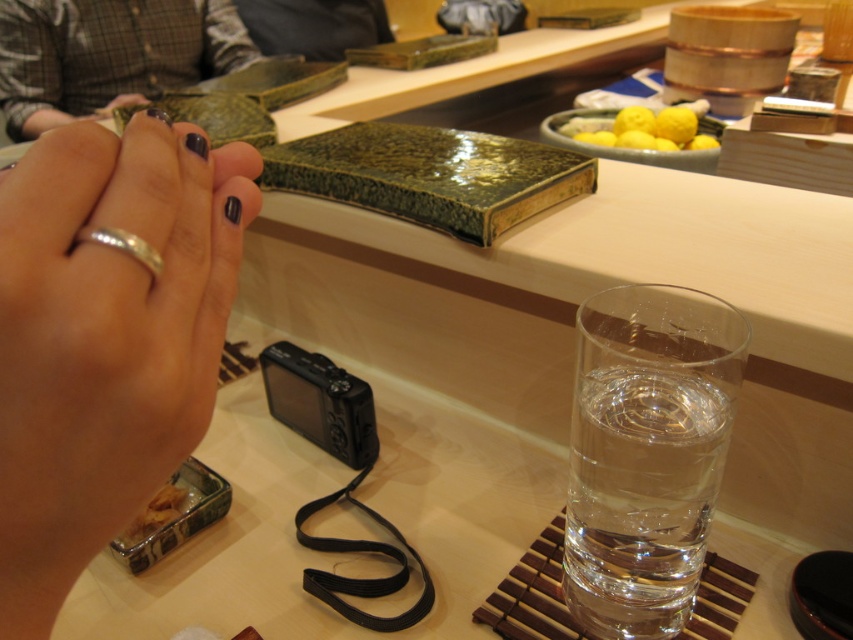
You are a photographer setting up a shoot at this table. You need to place a new prop between the matte plaid shirt at upper left and the nail polish at center. Where should you position it to ensure it is centered between them?

The matte plaid shirt at upper left is to the left of the nail polish at center, so placing the prop exactly halfway between them would center it between the two objects.

You are a photographer trying to place a small decorative item between the matte plaid shirt at upper left and the black rubber strap at lower center on the table. Based on their widths, can you determine if there is enough space for the item?

The matte plaid shirt at upper left might be wider than black rubber strap at lower center, so there may not be enough space between them for the decorative item.

You are a photographer setting up for a photoshoot. You have a silver metallic ring at lower left and yellow matte lemons at upper center on the table. Which object should you move if you want to make space for a larger tripod that requires more room near the center?

You should move the silver metallic ring at lower left because it is smaller than the yellow matte lemons at upper center and can be relocated to free up space near the center.